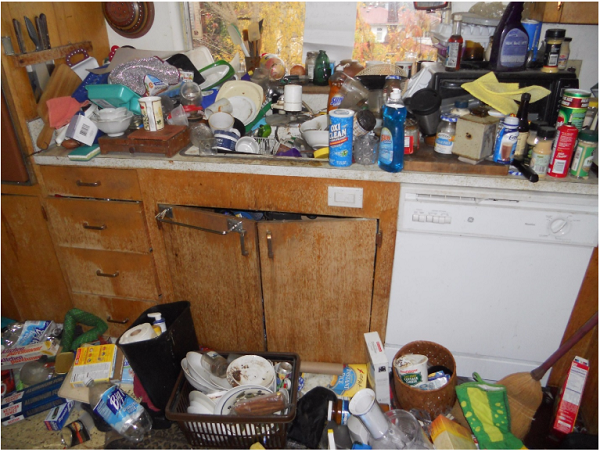
You are a GUI agent. You are given a task and a screenshot of the screen. Output one action in this format:
    pyautogui.click(x=<x>, y=<y>)
    Task: Click on the towel holder
    The height and width of the screenshot is (452, 600).
    Given the screenshot: What is the action you would take?
    pyautogui.click(x=227, y=233)